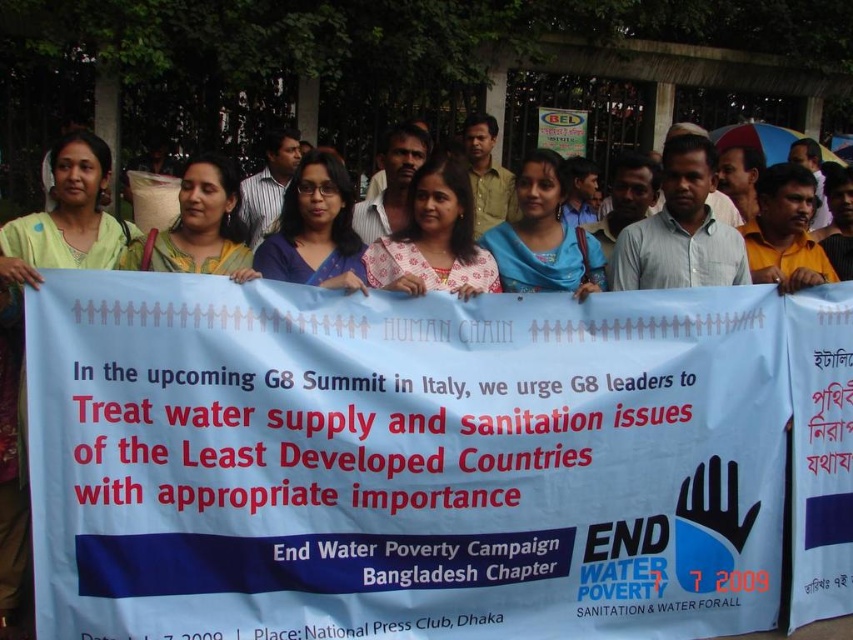
Question: Considering the relative positions of white paper banner at center and blue fabric banner at center in the image provided, where is white paper banner at center located with respect to blue fabric banner at center?

Choices:
 (A) above
 (B) below

Answer: (B)

Question: Which object is closer to the camera taking this photo?

Choices:
 (A) blue fabric banner at center
 (B) white paper banner at center

Answer: (B)

Question: Is white paper banner at center below blue fabric banner at center?

Choices:
 (A) no
 (B) yes

Answer: (B)

Question: Is white paper banner at center in front of blue fabric banner at center?

Choices:
 (A) no
 (B) yes

Answer: (B)

Question: Which of the following is the farthest from the observer?

Choices:
 (A) [x=183, y=193]
 (B) [x=358, y=470]

Answer: (A)